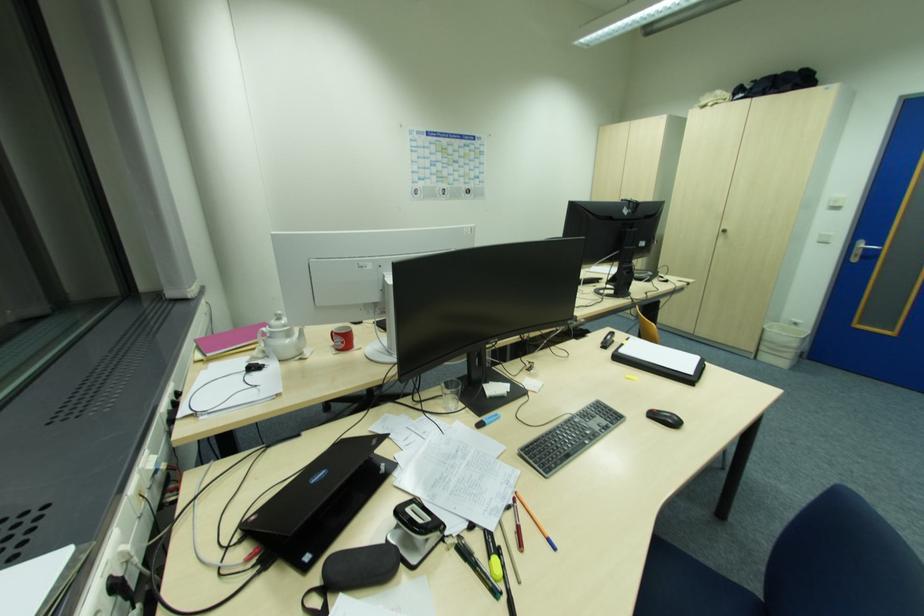
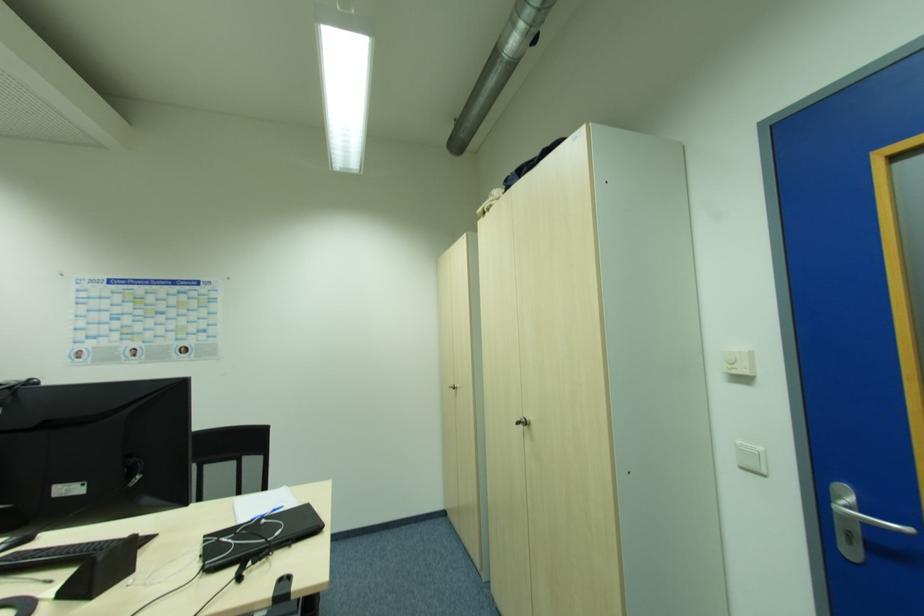
From the picture: The images are taken continuously from a first-person perspective. In which direction are you moving?

The movement direction of the cameraman is right, forward.